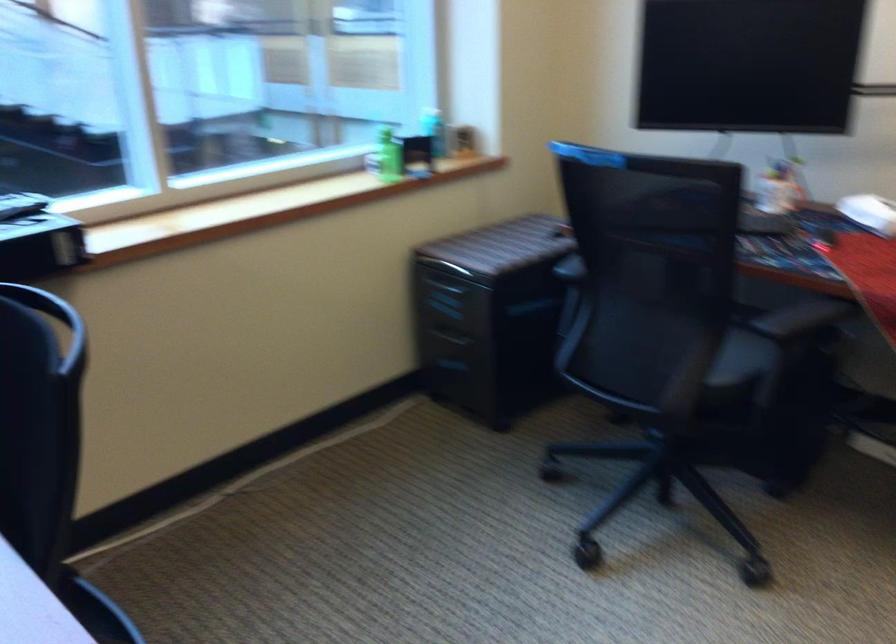
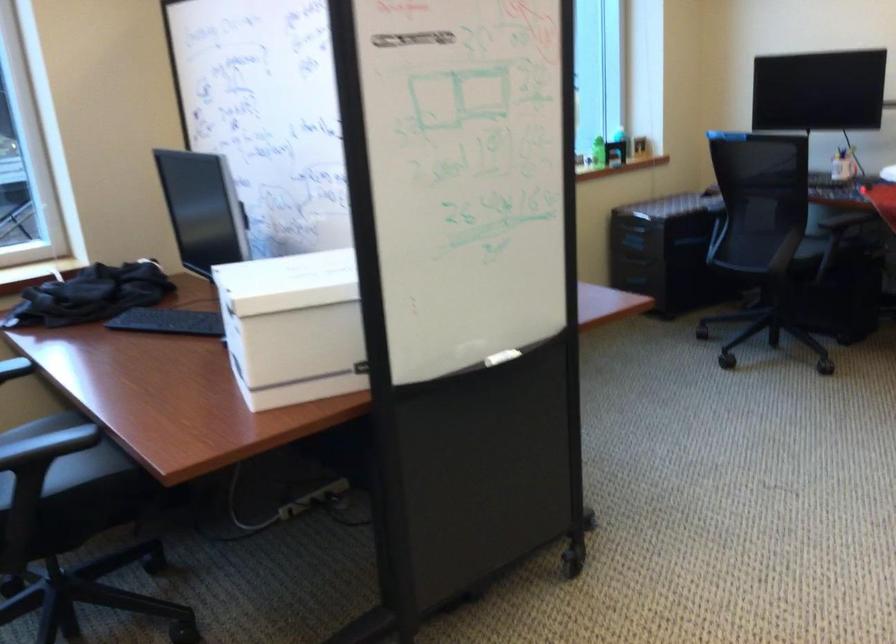
Where in the second image is the point corresponding to point 383,175 from the first image?

(598, 152)